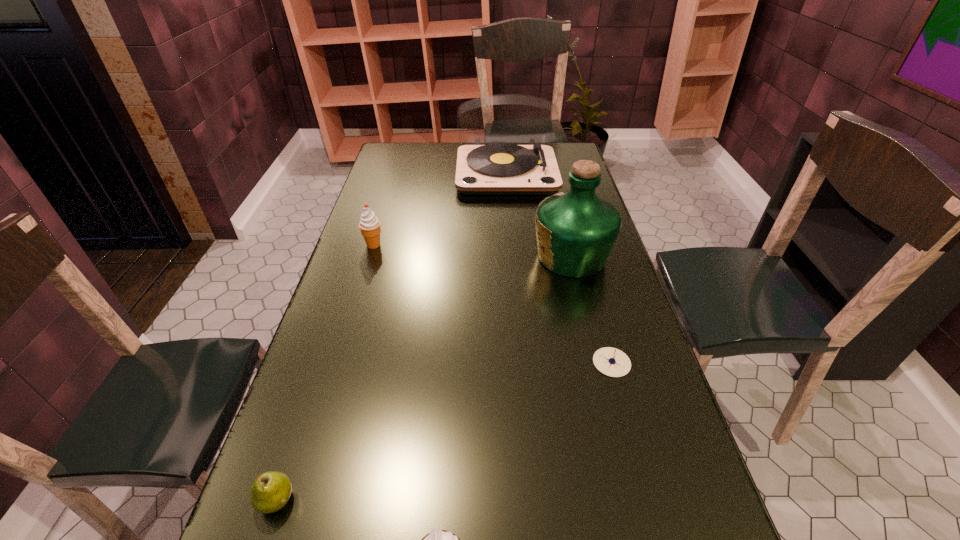
Image resolution: width=960 pixels, height=540 pixels. What are the coordinates of `vacant space positioned on the label side of the liquor` in the screenshot? It's located at (448, 256).

The height and width of the screenshot is (540, 960). I want to click on vacant area situated on the front of the farther icecream, so click(x=350, y=322).

Identify the location of vacant region located 0.210m on the back of the pear. (314, 387).

Identify the location of vacant area located 0.050m on the back of the third nearest object. The height and width of the screenshot is (540, 960). tap(603, 333).

Where is `object located in the far edge section of the desktop`? The image size is (960, 540). object located in the far edge section of the desktop is located at coordinates (494, 169).

Where is `icecream situated at the left edge`? This screenshot has height=540, width=960. icecream situated at the left edge is located at coordinates (x=369, y=225).

Find the location of a particular element. pear at the left edge is located at coordinates (270, 491).

Where is `record player situated at the right edge`? This screenshot has width=960, height=540. record player situated at the right edge is located at coordinates (494, 169).

Locate an element on the screen. liquor present at the right edge is located at coordinates (576, 230).

This screenshot has width=960, height=540. In order to click on compass located at the right edge in this screenshot , I will do `click(612, 362)`.